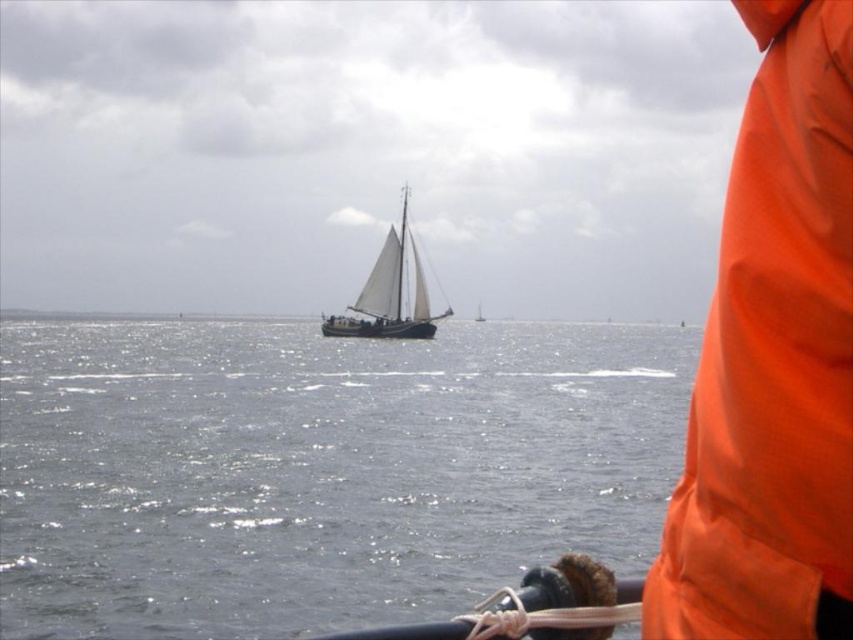
Between point (724, 436) and point (479, 316), which one is positioned in front?

Point (724, 436) is more forward.

Is point (756, 212) in front of point (477, 312)?

That is True.

At what (x,y) coordinates should I click in order to perform the action: click on orange fabric at right. Please return your answer as a coordinate pair (x, y). This screenshot has width=853, height=640. Looking at the image, I should click on (773, 362).

Which is below, glistening water at center or orange fabric at right?

orange fabric at right is lower down.

Does glistening water at center have a lesser height compared to orange fabric at right?

Indeed, glistening water at center has a lesser height compared to orange fabric at right.

Measure the distance between glistening water at center and camera.

7.12 meters

At what (x,y) coordinates should I click in order to perform the action: click on glistening water at center. Please return your answer as a coordinate pair (x, y). The image size is (853, 640). Looking at the image, I should click on (318, 468).

Does wooden sailboat at center have a smaller size compared to white canvas sailboat at center?

Actually, wooden sailboat at center might be larger than white canvas sailboat at center.

Between wooden sailboat at center and white canvas sailboat at center, which one appears on the left side from the viewer's perspective?

wooden sailboat at center is more to the left.

Is point (364, 330) positioned behind point (479, 321)?

No, (364, 330) is closer to viewer.

Identify the location of wooden sailboat at center. Image resolution: width=853 pixels, height=640 pixels. pyautogui.click(x=387, y=294).